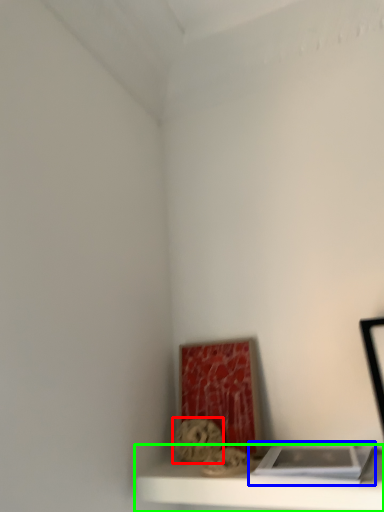
Question: Which object is the closest to the art (highlighted by a red box)? Choose among these: book (highlighted by a blue box) or shelf (highlighted by a green box).

Choices:
 (A) book
 (B) shelf

Answer: (B)